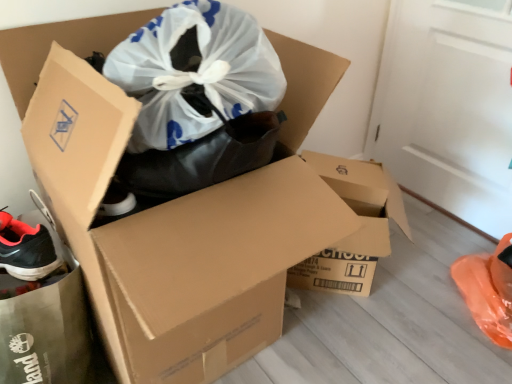
The height and width of the screenshot is (384, 512). I want to click on free space in front of brown cardboard box at center, the 1th box viewed from the right, so click(x=358, y=355).